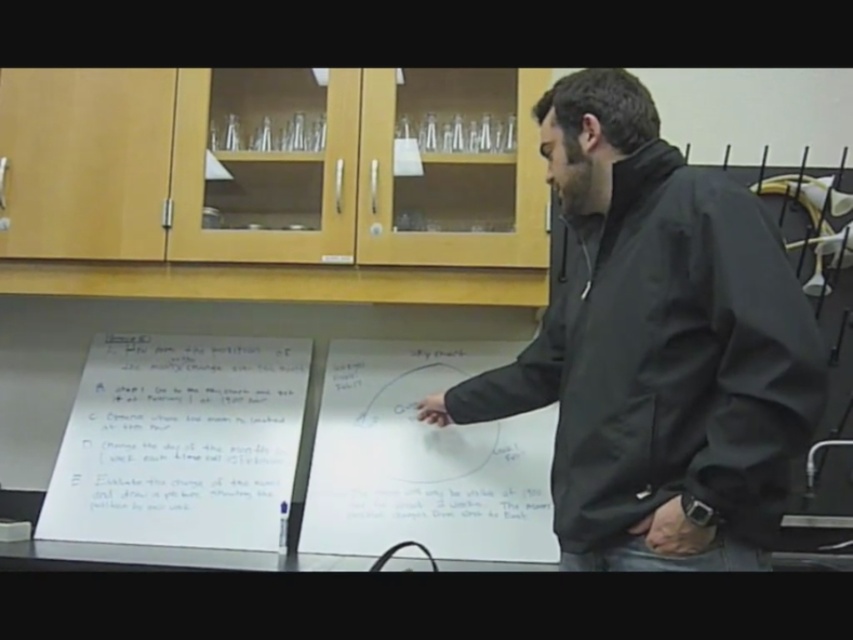
Question: Which object appears closest to the camera in this image?

Choices:
 (A) white matte board at center
 (B) white paper at center
 (C) black matte jacket at center

Answer: (C)

Question: Which is nearer to the white matte board at center?

Choices:
 (A) black matte jacket at center
 (B) white paper at center

Answer: (B)

Question: In this image, where is white paper at center located relative to white matte board at center?

Choices:
 (A) below
 (B) above

Answer: (B)

Question: Is the position of white paper at center more distant than that of white matte board at center?

Choices:
 (A) yes
 (B) no

Answer: (A)

Question: Which is farther from the black matte jacket at center?

Choices:
 (A) white matte board at center
 (B) white paper at center

Answer: (B)

Question: Is black matte jacket at center smaller than white paper at center?

Choices:
 (A) no
 (B) yes

Answer: (A)